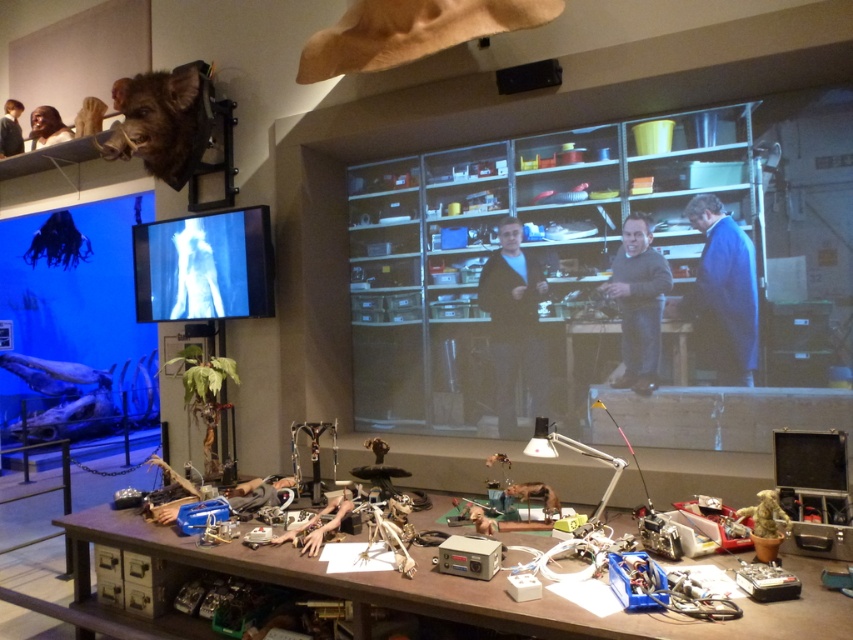
Who is lower down, wooden table at center or matte black screen at center?

Positioned lower is wooden table at center.

Locate an element on the screen. wooden table at center is located at coordinates (451, 588).

Image resolution: width=853 pixels, height=640 pixels. What are the coordinates of `wooden table at center` in the screenshot? It's located at (451, 588).